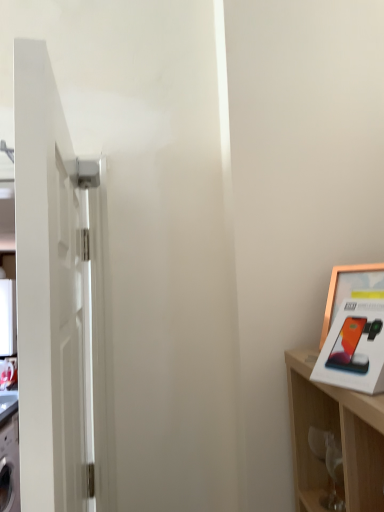
Question: Is gold metallic picture frame at upper right to the right of white glossy door at left from the viewer's perspective?

Choices:
 (A) yes
 (B) no

Answer: (A)

Question: Is white glossy door at left a part of gold metallic picture frame at upper right?

Choices:
 (A) yes
 (B) no

Answer: (B)

Question: Can you confirm if gold metallic picture frame at upper right is smaller than white glossy door at left?

Choices:
 (A) no
 (B) yes

Answer: (B)

Question: Considering the relative positions of gold metallic picture frame at upper right and white glossy door at left in the image provided, is gold metallic picture frame at upper right to the left of white glossy door at left from the viewer's perspective?

Choices:
 (A) yes
 (B) no

Answer: (B)

Question: Is gold metallic picture frame at upper right facing away from white glossy door at left?

Choices:
 (A) no
 (B) yes

Answer: (A)

Question: Is gold metallic picture frame at upper right further to camera compared to white glossy door at left?

Choices:
 (A) no
 (B) yes

Answer: (B)

Question: Is white glossy door at left wider than gold metallic picture frame at upper right?

Choices:
 (A) no
 (B) yes

Answer: (B)

Question: Does white glossy door at left appear on the left side of gold metallic picture frame at upper right?

Choices:
 (A) yes
 (B) no

Answer: (A)

Question: Is white glossy door at left facing away from gold metallic picture frame at upper right?

Choices:
 (A) yes
 (B) no

Answer: (A)

Question: From the image's perspective, is white glossy door at left over gold metallic picture frame at upper right?

Choices:
 (A) yes
 (B) no

Answer: (B)

Question: Does white glossy door at left have a greater height compared to gold metallic picture frame at upper right?

Choices:
 (A) yes
 (B) no

Answer: (A)

Question: Is white glossy door at left closer to camera compared to gold metallic picture frame at upper right?

Choices:
 (A) no
 (B) yes

Answer: (B)

Question: From the image's perspective, is gold metallic picture frame at upper right above or below white glossy door at left?

Choices:
 (A) below
 (B) above

Answer: (B)